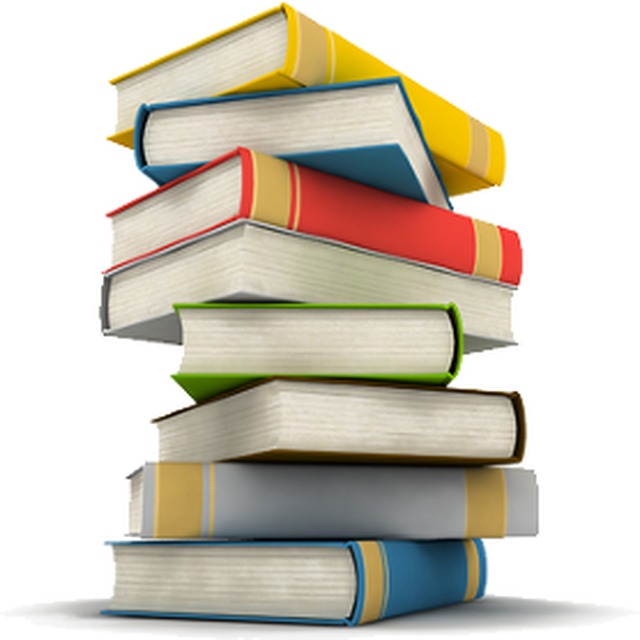
The height and width of the screenshot is (640, 640). I want to click on books, so click(x=209, y=58), click(x=236, y=131), click(x=236, y=179), click(x=248, y=273), click(x=285, y=342), click(x=300, y=412), click(x=284, y=497), click(x=276, y=566).